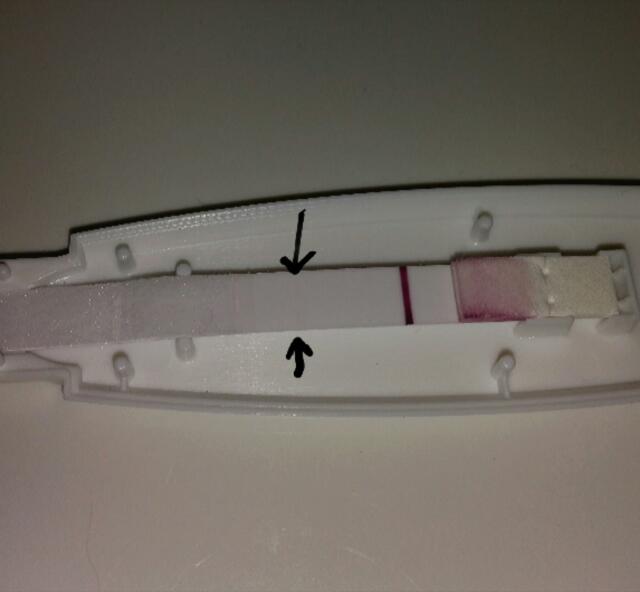
You are a GUI agent. You are given a task and a screenshot of the screen. Output one action in this format:
    pyautogui.click(x=<x>, y=<y>)
    Task: Click on the plastic tray
    
    Given the screenshot: What is the action you would take?
    pyautogui.click(x=406, y=374)